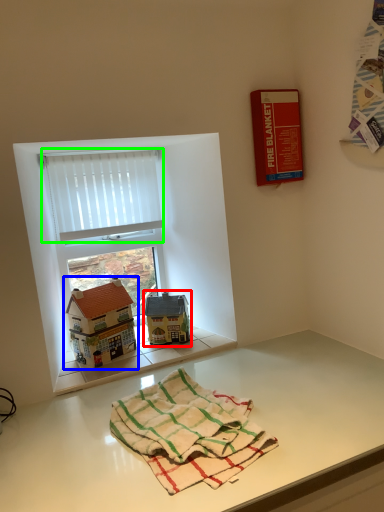
Question: Which object is the closest to the toy (highlighted by a red box)? Choose among these: toy (highlighted by a blue box) or curtain (highlighted by a green box).

Choices:
 (A) toy
 (B) curtain

Answer: (A)